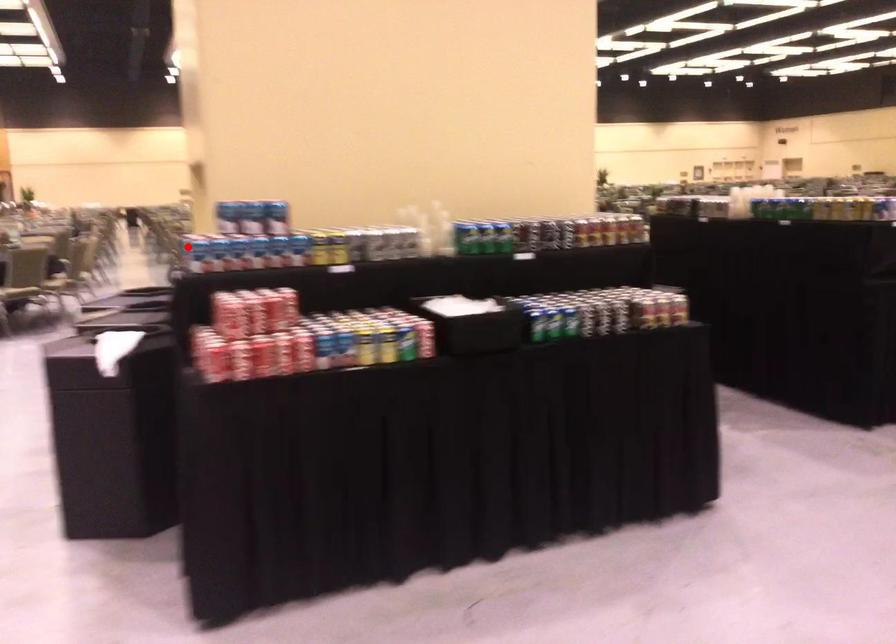
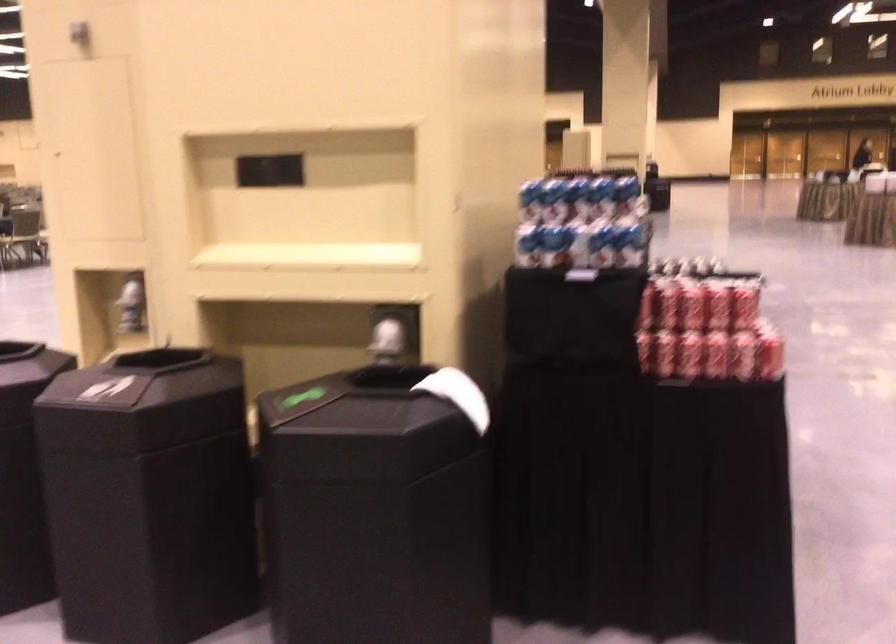
Question: I am providing you with two images of the same scene from different viewpoints. A red point is shown in image1. For the corresponding object point in image2, is it positioned nearer or farther from the camera?

Choices:
 (A) Nearer
 (B) Farther

Answer: (A)